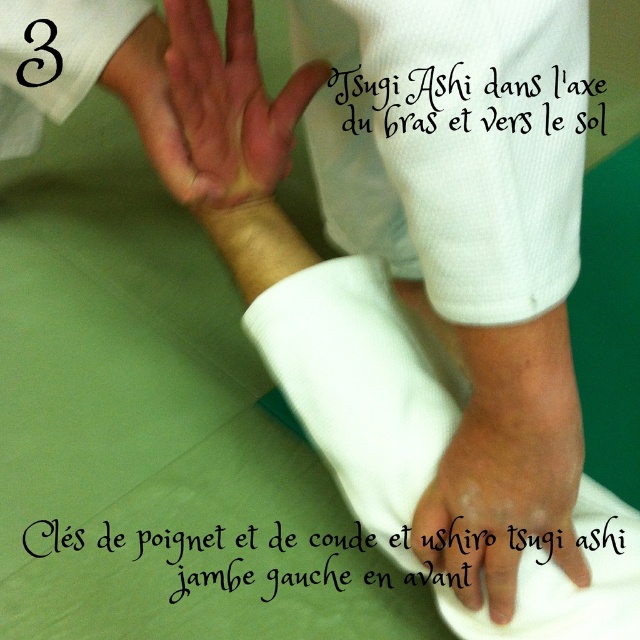
Question: Which point is farther to the camera?

Choices:
 (A) (445, 564)
 (B) (220, 90)

Answer: (B)

Question: Can you confirm if white matte hand at center is smaller than pinkish skin at center?

Choices:
 (A) no
 (B) yes

Answer: (B)

Question: Does white matte hand at center have a greater width compared to pinkish skin at center?

Choices:
 (A) yes
 (B) no

Answer: (B)

Question: Is white matte hand at center wider than pinkish skin at center?

Choices:
 (A) no
 (B) yes

Answer: (A)

Question: Among these points, which one is farthest from the camera?

Choices:
 (A) (444, 540)
 (B) (205, 173)

Answer: (B)